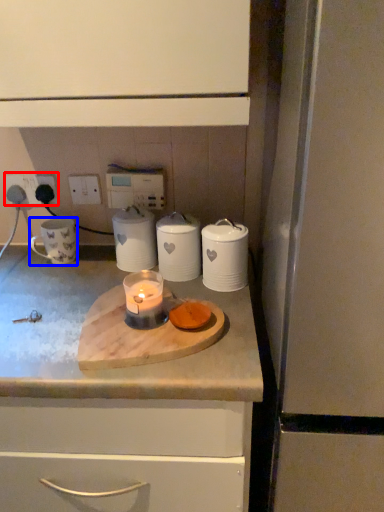
Question: Which point is further to the camera, electric outlet (highlighted by a red box) or mug (highlighted by a blue box)?

Choices:
 (A) electric outlet
 (B) mug

Answer: (A)